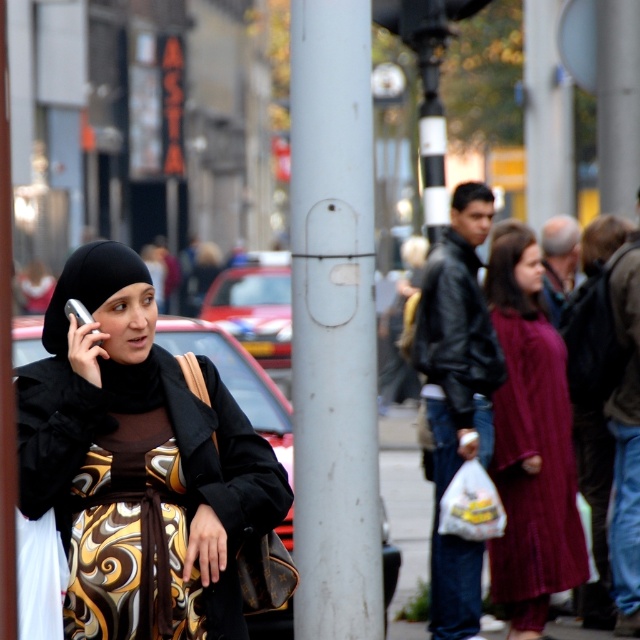
Question: Is matte black hijab at center positioned at the back of maroon textured dress at center?

Choices:
 (A) yes
 (B) no

Answer: (B)

Question: Which object is the closest to the white matte pole at center?

Choices:
 (A) gold patterned dress at center
 (B) matte black hijab at center

Answer: (B)

Question: Can you confirm if gold patterned dress at center is positioned above silver metallic phone at left?

Choices:
 (A) yes
 (B) no

Answer: (B)

Question: Which point appears farthest from the camera in this image?

Choices:
 (A) (364, 442)
 (B) (108, 241)
 (C) (147, 451)
 (D) (81, 321)

Answer: (A)

Question: Can you confirm if white matte pole at center is bigger than maroon textured dress at center?

Choices:
 (A) no
 (B) yes

Answer: (A)

Question: Which point is farther to the camera?

Choices:
 (A) (168, 371)
 (B) (298, 269)
 (C) (172, 502)
 (D) (83, 324)

Answer: (B)